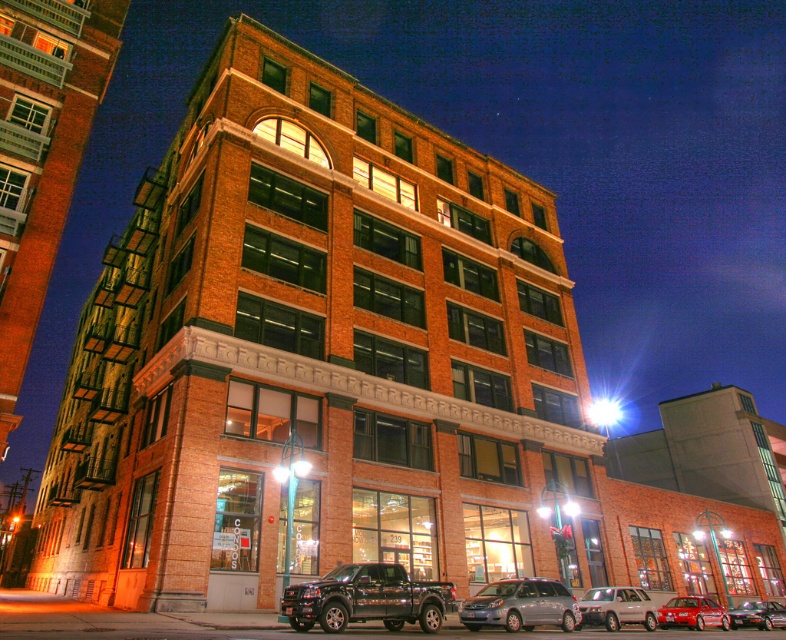
Can you confirm if shiny red sedan at lower right is shorter than metallic silver sedan at center?

Incorrect, shiny red sedan at lower right's height does not fall short of metallic silver sedan at center's.

Between point (711, 621) and point (781, 625), which one is positioned in front?

Point (711, 621) is in front.

Where is `shiny red sedan at lower right`? shiny red sedan at lower right is located at coordinates (692, 612).

Between silver metallic suv at center and metallic silver sedan at center, which one appears on the right side from the viewer's perspective?

From the viewer's perspective, metallic silver sedan at center appears more on the right side.

Is silver metallic suv at center bigger than metallic silver sedan at center?

Incorrect, silver metallic suv at center is not larger than metallic silver sedan at center.

Measure the distance between point [605,625] and camera.

They are 32.68 meters apart.

Locate an element on the screen. Image resolution: width=786 pixels, height=640 pixels. silver metallic suv at center is located at coordinates (616, 608).

Measure the distance between point (x=619, y=593) and camera.

The distance of point (x=619, y=593) from camera is 113.73 feet.

Looking at this image, can you confirm if silver metallic suv at center is thinner than shiny red sedan at lower right?

Yes.

Does point (641, 602) lie in front of point (681, 612)?

That is True.

You are a GUI agent. You are given a task and a screenshot of the screen. Output one action in this format:
    pyautogui.click(x=<x>, y=<y>)
    Task: Click on the silver metallic suv at center
    The height and width of the screenshot is (640, 786).
    Given the screenshot: What is the action you would take?
    pyautogui.click(x=616, y=608)